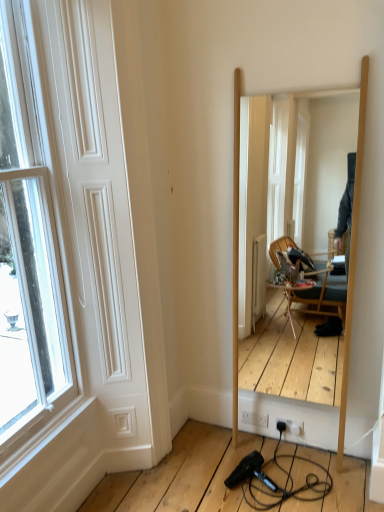
The width and height of the screenshot is (384, 512). I want to click on white matte door at left, so click(x=77, y=230).

The image size is (384, 512). Find the location of `wooden mirror at center`. wooden mirror at center is located at coordinates (292, 177).

What is the approximate width of black plastic hair dryer at lower center?

black plastic hair dryer at lower center is 7.95 inches wide.

This screenshot has width=384, height=512. Find the location of `white matte door at left`. white matte door at left is located at coordinates (77, 230).

In the scene shown: From the image's perspective, is black plastic hair dryer at lower center over white matte door at left?

No, from the image's perspective, black plastic hair dryer at lower center is not over white matte door at left.

Is white matte door at left located within black plastic hair dryer at lower center?

No.

Could you tell me if black plastic hair dryer at lower center is turned towards white matte door at left?

No, black plastic hair dryer at lower center is not oriented towards white matte door at left.

Is wooden mirror at center further to the viewer compared to black plastic hair dryer at lower center?

No, the depth of wooden mirror at center is less than that of black plastic hair dryer at lower center.

Is wooden mirror at center to the right of black plastic hair dryer at lower center from the viewer's perspective?

Yes.

From the image's perspective, between wooden mirror at center and black plastic hair dryer at lower center, who is located below?

black plastic hair dryer at lower center.

Could you tell me if wooden mirror at center is turned towards black plastic hair dryer at lower center?

Yes, wooden mirror at center faces towards black plastic hair dryer at lower center.

Is white matte door at left in contact with black plastic hair dryer at lower center?

They are not placed beside each other.

In terms of width, does white matte door at left look wider or thinner when compared to black plastic hair dryer at lower center?

Considering their sizes, white matte door at left looks slimmer than black plastic hair dryer at lower center.

In the scene shown: Which of these two, white matte door at left or black plastic hair dryer at lower center, is bigger?

white matte door at left.

From the image's perspective, would you say white matte door at left is shown under black plastic hair dryer at lower center?

Actually, white matte door at left appears above black plastic hair dryer at lower center in the image.

Is black plastic hair dryer at lower center wider or thinner than wooden mirror at center?

Considering their sizes, black plastic hair dryer at lower center looks broader than wooden mirror at center.

From the image's perspective, is black plastic hair dryer at lower center above wooden mirror at center?

No.

Is the position of black plastic hair dryer at lower center more distant than that of wooden mirror at center?

Yes, it is.

Choose the correct answer: Is white matte door at left inside wooden mirror at center or outside it?

white matte door at left is not inside wooden mirror at center, it's outside.

Considering the positions of point (44, 346) and point (337, 398), is point (44, 346) closer or farther from the camera than point (337, 398)?

Point (44, 346).

Which is behind, white matte door at left or wooden mirror at center?

wooden mirror at center.

From the image's perspective, is white matte door at left above or below wooden mirror at center?

white matte door at left is situated lower than wooden mirror at center in the image.

Between wooden mirror at center and white matte door at left, which one has larger width?

wooden mirror at center is wider.

In the scene shown: Considering the sizes of objects wooden mirror at center and white matte door at left in the image provided, who is taller, wooden mirror at center or white matte door at left?

white matte door at left.

The width and height of the screenshot is (384, 512). Identify the location of mirror below the white matte door at left (from a real-world perspective). (292, 177).

From the picture: Who is smaller, wooden mirror at center or white matte door at left?

Smaller between the two is white matte door at left.

Locate an element on the screen. The image size is (384, 512). hair drier that appears below the white matte door at left (from the image's perspective) is located at coordinates (250, 472).

The width and height of the screenshot is (384, 512). I want to click on hair drier behind the wooden mirror at center, so click(250, 472).

When comparing their distances from white matte door at left, does wooden mirror at center or black plastic hair dryer at lower center seem closer?

black plastic hair dryer at lower center is positioned closer to the anchor white matte door at left.

Looking at the image, which one is located further to black plastic hair dryer at lower center, wooden mirror at center or white matte door at left?

Among the two, wooden mirror at center is located further to black plastic hair dryer at lower center.

From the picture: Looking at the image, which one is located closer to black plastic hair dryer at lower center, white matte door at left or wooden mirror at center?

white matte door at left.

Based on the photo, looking at the image, which one is located closer to wooden mirror at center, white matte door at left or black plastic hair dryer at lower center?

Based on the image, white matte door at left appears to be nearer to wooden mirror at center.

Based on their spatial positions, is black plastic hair dryer at lower center or wooden mirror at center closer to white matte door at left?

black plastic hair dryer at lower center.

Looking at the image, which one is located further to wooden mirror at center, black plastic hair dryer at lower center or white matte door at left?

black plastic hair dryer at lower center is positioned further to the anchor wooden mirror at center.

This screenshot has width=384, height=512. What are the coordinates of `mirror between white matte door at left and black plastic hair dryer at lower center along the z-axis` in the screenshot? It's located at [292, 177].